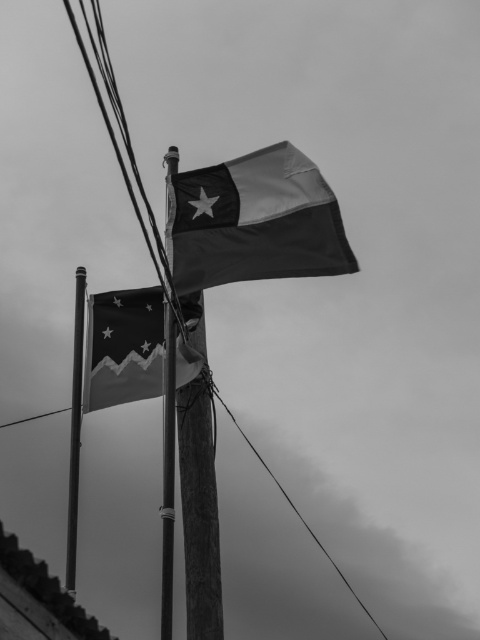
Does wooden pole at center have a lesser height compared to smooth wire at center?

Correct, wooden pole at center is not as tall as smooth wire at center.

Between point (170, 616) and point (345, 580), which one is positioned behind?

The point (345, 580) is behind.

Find the location of a particular element. wooden pole at center is located at coordinates (168, 472).

Between silky black flag at upper center and wooden pole at center, which one appears on the right side from the viewer's perspective?

From the viewer's perspective, silky black flag at upper center appears more on the right side.

The width and height of the screenshot is (480, 640). Find the location of `silky black flag at upper center`. silky black flag at upper center is located at coordinates (254, 221).

Is point (218, 280) less distant than point (168, 483)?

That is False.

This screenshot has width=480, height=640. Find the location of `silky black flag at upper center`. silky black flag at upper center is located at coordinates (254, 221).

How far apart are silky black flag at upper center and smooth wire at center?

silky black flag at upper center and smooth wire at center are 6.90 meters apart.

Does silky black flag at upper center have a lesser height compared to smooth wire at center?

Yes.

Locate an element on the screen. silky black flag at upper center is located at coordinates (254, 221).

The width and height of the screenshot is (480, 640). Identify the location of silky black flag at upper center. (254, 221).